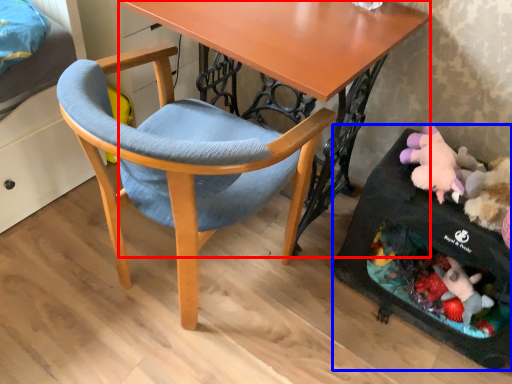
Question: Among these objects, which one is nearest to the camera, desk (highlighted by a red box) or baby carriage (highlighted by a blue box)?

Choices:
 (A) desk
 (B) baby carriage

Answer: (A)